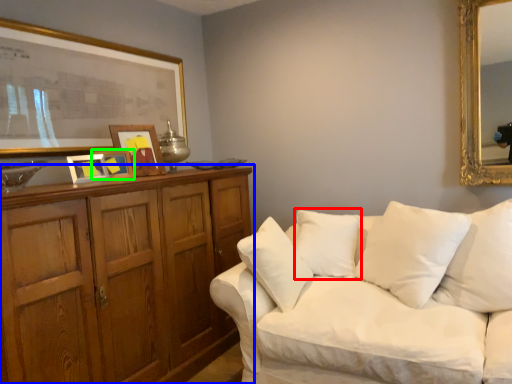
Question: Which object is positioned farthest from pillow (highlighted by a red box)? Select from cabinetry (highlighted by a blue box) and picture frame (highlighted by a green box).

Choices:
 (A) cabinetry
 (B) picture frame

Answer: (B)